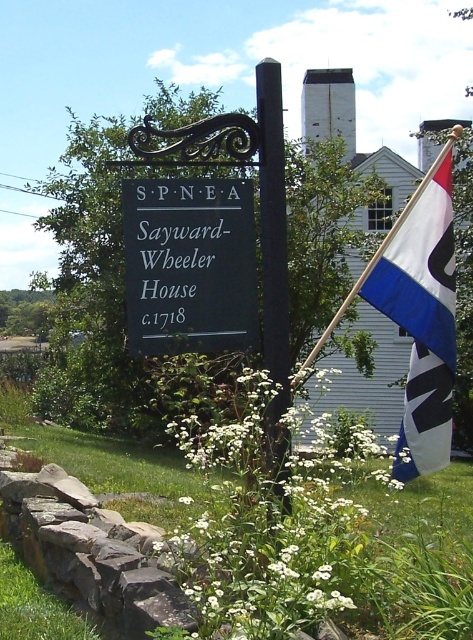
Question: Does black matte sign at center appear on the left side of black wood pole at center?

Choices:
 (A) yes
 (B) no

Answer: (A)

Question: Based on their relative distances, which object is farther from the black wood pole at center?

Choices:
 (A) blue and white fabric flag at right
 (B) white fluffy flowers at center

Answer: (B)

Question: Among these objects, which one is nearest to the camera?

Choices:
 (A) white fluffy flowers at center
 (B) black matte sign at center

Answer: (A)

Question: Which point appears farthest from the camera in this image?

Choices:
 (A) (241, 376)
 (B) (432, 349)

Answer: (A)

Question: Is black matte sign at center bigger than blue and white fabric flag at right?

Choices:
 (A) yes
 (B) no

Answer: (B)

Question: Is white fluffy flowers at center bigger than blue and white fabric flag at right?

Choices:
 (A) yes
 (B) no

Answer: (A)